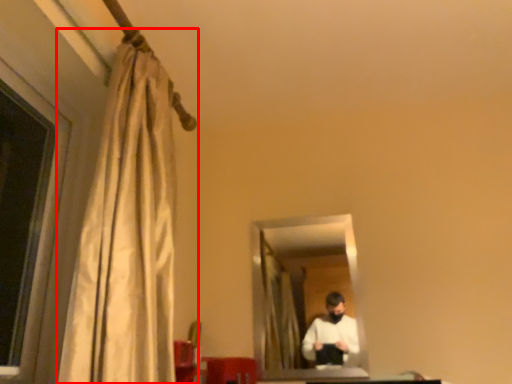
Question: Where is curtain (annotated by the red box) located in relation to mirror in the image?

Choices:
 (A) left
 (B) right

Answer: (A)